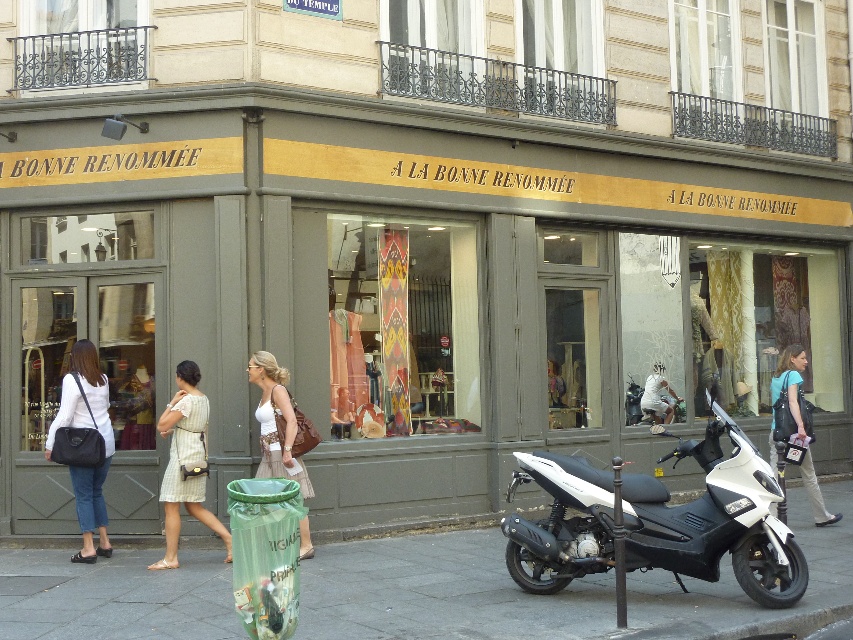
Can you confirm if matte gray storefront at center is positioned above white matte scooter at center?

Correct, matte gray storefront at center is located above white matte scooter at center.

Consider the image. Does matte gray storefront at center appear on the right side of white matte scooter at center?

No, matte gray storefront at center is not to the right of white matte scooter at center.

Which is behind, point (838, 227) or point (798, 582)?

Positioned behind is point (838, 227).

Where is `matte gray storefront at center`? The image size is (853, 640). matte gray storefront at center is located at coordinates (403, 280).

Which is in front, point (674, 125) or point (790, 417)?

Point (790, 417) is more forward.

Between matte gray storefront at center and blue fabric backpack at lower right, which one has less height?

With less height is blue fabric backpack at lower right.

Who is more distant from viewer, (10,250) or (793,365)?

Point (793,365)

Where is `matte gray storefront at center`? matte gray storefront at center is located at coordinates (403, 280).

Is white matte scooter at center taller than blue fabric backpack at lower right?

In fact, white matte scooter at center may be shorter than blue fabric backpack at lower right.

Which is above, white matte scooter at center or blue fabric backpack at lower right?

blue fabric backpack at lower right

Does point (762, 560) lie in front of point (788, 388)?

Yes, point (762, 560) is in front of point (788, 388).

In order to click on white matte scooter at center in this screenshot , I will do `click(717, 520)`.